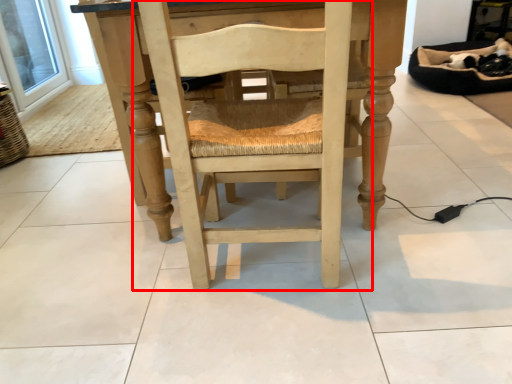
Question: Considering the relative positions of chair (annotated by the red box) and window screen in the image provided, where is chair (annotated by the red box) located with respect to the staircase?

Choices:
 (A) right
 (B) left

Answer: (A)